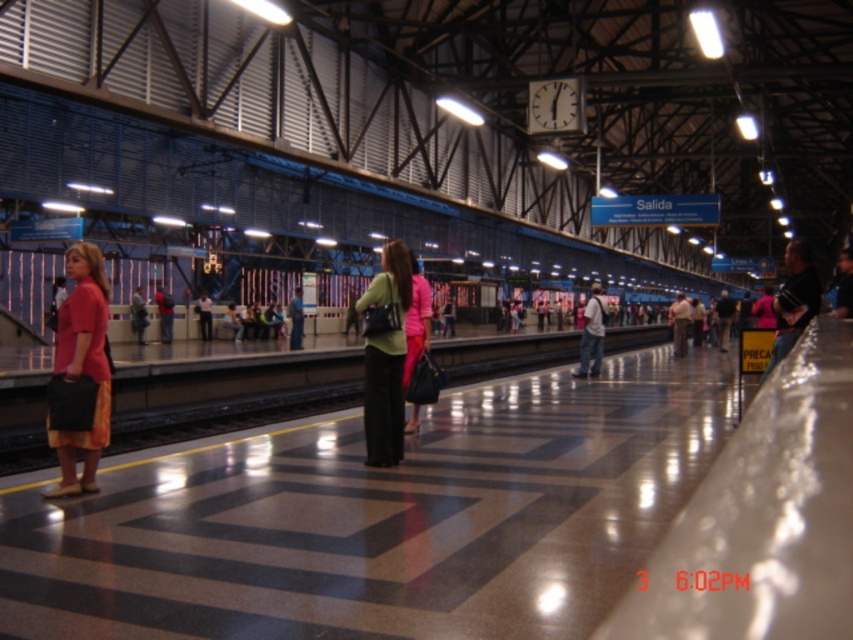
Question: Which object is positioned closest to the matte green sweater at center?

Choices:
 (A) light pink shirt at center
 (B) matte pink blouse at left

Answer: (B)

Question: Which of the following is the farthest from the observer?

Choices:
 (A) matte pink shirt at left
 (B) green fabric handbag at center
 (C) light pink shirt at center
 (D) matte black backpack at center

Answer: (C)

Question: Does matte black backpack at center have a greater width compared to light pink shirt at center?

Choices:
 (A) no
 (B) yes

Answer: (B)

Question: Does matte green sweater at center have a lesser width compared to green fabric handbag at center?

Choices:
 (A) yes
 (B) no

Answer: (B)

Question: In this image, where is matte green sweater at center located relative to matte pink shirt at left?

Choices:
 (A) above
 (B) below

Answer: (A)

Question: Which object is positioned farthest from the light pink shirt at center?

Choices:
 (A) matte black backpack at center
 (B) matte green sweater at center

Answer: (B)